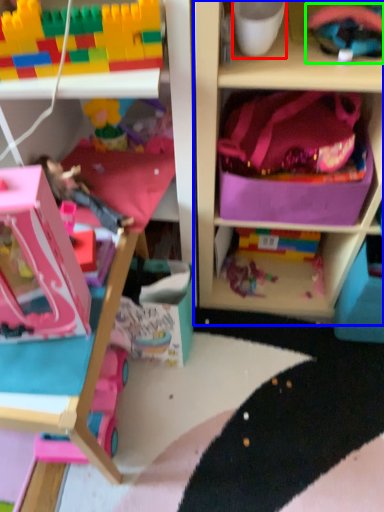
Question: Estimate the real-world distances between objects in this image. Which object is farther from coffee cup (highlighted by a red box), shelf (highlighted by a blue box) or toy (highlighted by a green box)?

Choices:
 (A) shelf
 (B) toy

Answer: (A)